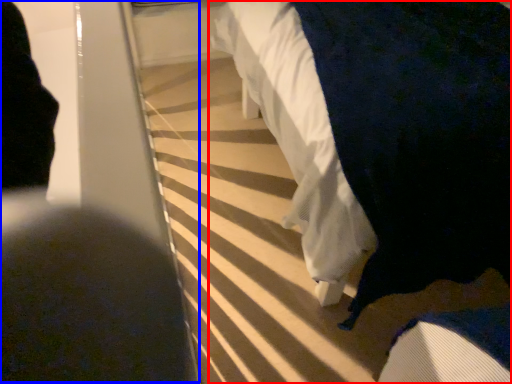
Question: Which point is closer to the camera, furniture (highlighted by a red box) or person (highlighted by a blue box)?

Choices:
 (A) furniture
 (B) person

Answer: (B)